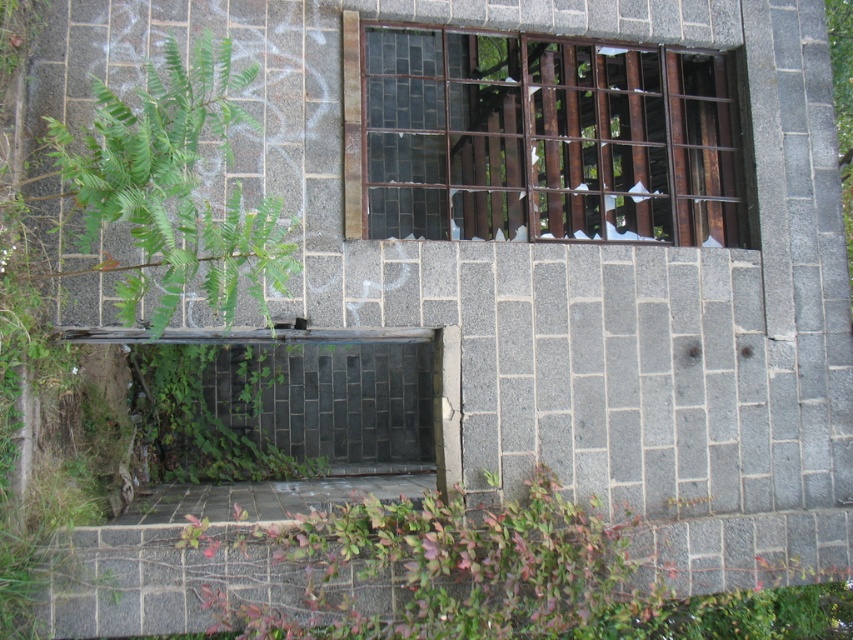
Can you confirm if green leafy plant at lower center is positioned below green leafy plant at left?

Correct, green leafy plant at lower center is located below green leafy plant at left.

Can you confirm if green leafy plant at lower center is shorter than green leafy plant at left?

Indeed, green leafy plant at lower center has a lesser height compared to green leafy plant at left.

Is point (419, 595) positioned in front of point (161, 96)?

No, it is behind (161, 96).

Find the location of a particular element. green leafy plant at lower center is located at coordinates (508, 577).

Can you confirm if rusty metal bars at upper center is taller than green leafy plant at lower center?

Yes.

Where is `rusty metal bars at upper center`? This screenshot has height=640, width=853. rusty metal bars at upper center is located at coordinates (537, 138).

Is point (608, 60) less distant than point (440, 548)?

No, (608, 60) is further to viewer.

Where is `rusty metal bars at upper center`? The height and width of the screenshot is (640, 853). rusty metal bars at upper center is located at coordinates (537, 138).

Which is above, rusty metal bars at upper center or green leafy plant at left?

rusty metal bars at upper center

Is rusty metal bars at upper center taller than green leafy plant at left?

No.

The image size is (853, 640). I want to click on rusty metal bars at upper center, so click(537, 138).

In order to click on rusty metal bars at upper center in this screenshot , I will do `click(537, 138)`.